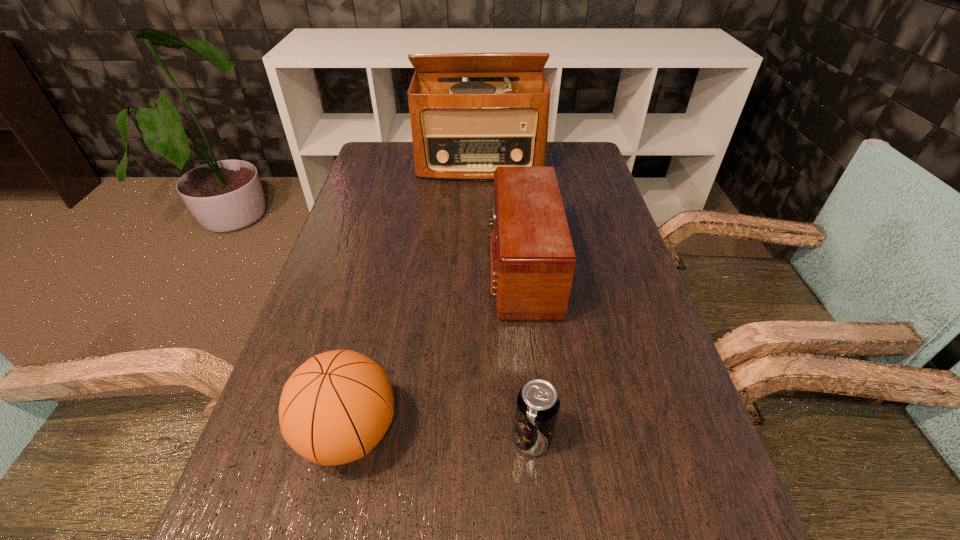
Where is `vacant space located 0.070m on the back of the basketball`? This screenshot has width=960, height=540. vacant space located 0.070m on the back of the basketball is located at coordinates (367, 359).

Locate an element on the screen. vacant space located 0.050m on the right of the soda can is located at coordinates (581, 439).

Identify the location of object located in the far edge section of the desktop. click(461, 130).

Locate an element on the screen. The height and width of the screenshot is (540, 960). object present at the left edge is located at coordinates (336, 407).

This screenshot has width=960, height=540. I want to click on vacant space at the left edge, so click(348, 204).

The width and height of the screenshot is (960, 540). Identify the location of vacant space at the right edge of the desktop. 569,178.

Image resolution: width=960 pixels, height=540 pixels. In the image, there is a desktop. What are the coordinates of `blank space at the far left corner` in the screenshot? It's located at (361, 173).

In the image, there is a desktop. Identify the location of free region at the far right corner. (589, 171).

Locate an element on the screen. The width and height of the screenshot is (960, 540). free space between the second farthest object and the basketball is located at coordinates (435, 350).

Find the location of a particular element. free point between the shortest object and the shorter radio receiver is located at coordinates (527, 354).